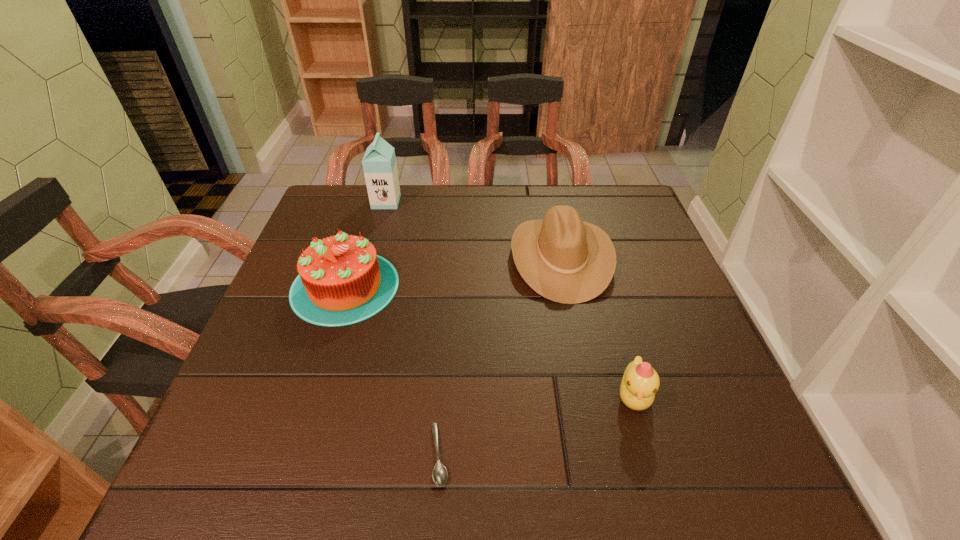
Locate an element on the screen. vacant point that satisfies the following two spatial constraints: 1. on the front side of the cowboy hat; 2. on the right side of the farthest object is located at coordinates (371, 257).